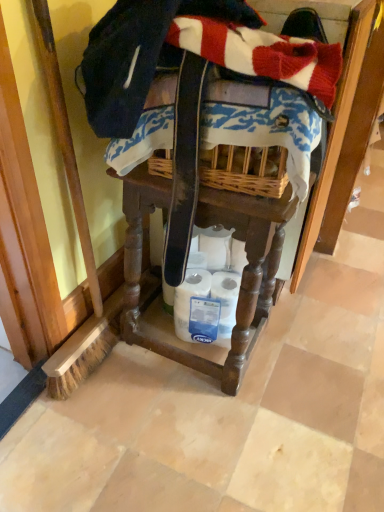
Question: Is wooden vanity at center far away from blue printed fabric at center?

Choices:
 (A) yes
 (B) no

Answer: (B)

Question: Can you confirm if wooden vanity at center is shorter than blue printed fabric at center?

Choices:
 (A) yes
 (B) no

Answer: (B)

Question: Considering the relative positions of wooden vanity at center and blue printed fabric at center in the image provided, is wooden vanity at center to the right of blue printed fabric at center from the viewer's perspective?

Choices:
 (A) yes
 (B) no

Answer: (B)

Question: Is blue printed fabric at center located within wooden vanity at center?

Choices:
 (A) yes
 (B) no

Answer: (B)

Question: Can you confirm if wooden vanity at center is smaller than blue printed fabric at center?

Choices:
 (A) no
 (B) yes

Answer: (A)

Question: From the image's perspective, is wooden vanity at center over blue printed fabric at center?

Choices:
 (A) yes
 (B) no

Answer: (B)

Question: Can you confirm if blue printed fabric at center is positioned to the right of white matte toilet paper at lower center?

Choices:
 (A) yes
 (B) no

Answer: (A)

Question: Can you confirm if blue printed fabric at center is taller than white matte toilet paper at lower center?

Choices:
 (A) no
 (B) yes

Answer: (A)

Question: Can you confirm if blue printed fabric at center is smaller than white matte toilet paper at lower center?

Choices:
 (A) no
 (B) yes

Answer: (A)

Question: Is blue printed fabric at center wider than white matte toilet paper at lower center?

Choices:
 (A) yes
 (B) no

Answer: (A)

Question: Considering the relative positions of blue printed fabric at center and white matte toilet paper at lower center in the image provided, is blue printed fabric at center in front of white matte toilet paper at lower center?

Choices:
 (A) no
 (B) yes

Answer: (B)

Question: Is blue printed fabric at center positioned beyond the bounds of white matte toilet paper at lower center?

Choices:
 (A) no
 (B) yes

Answer: (B)

Question: Does white matte toilet paper at lower center have a lesser height compared to wooden vanity at center?

Choices:
 (A) no
 (B) yes

Answer: (B)